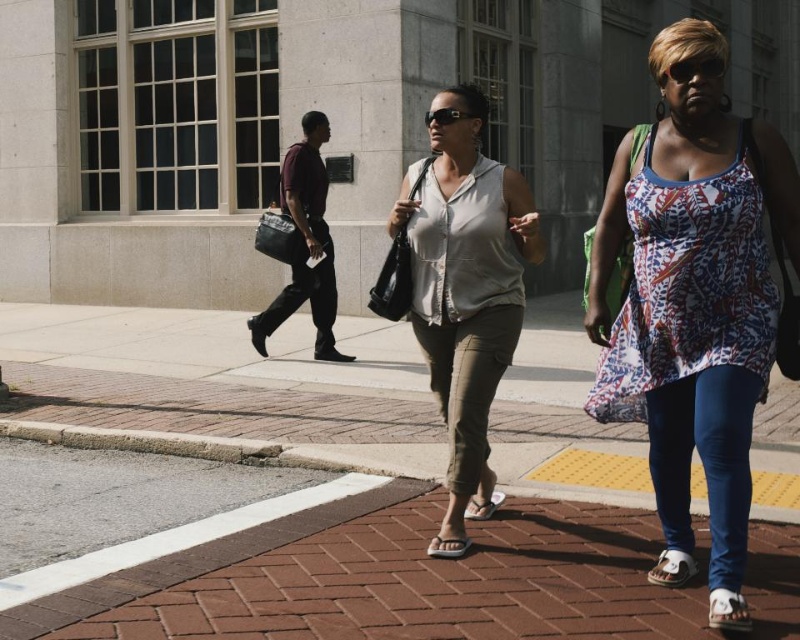
Question: Which of the following is the farthest from the observer?

Choices:
 (A) (288, 257)
 (B) (524, 228)

Answer: (A)

Question: Can you confirm if printed fabric tank top at center is positioned above dark maroon fabric bag at center?

Choices:
 (A) no
 (B) yes

Answer: (A)

Question: Can you confirm if printed fabric tank top at center is smaller than matte gray shirt at center?

Choices:
 (A) yes
 (B) no

Answer: (B)

Question: Observing the image, what is the correct spatial positioning of matte gray shirt at center in reference to dark maroon fabric bag at center?

Choices:
 (A) above
 (B) below

Answer: (B)

Question: Which object appears farthest from the camera in this image?

Choices:
 (A) printed fabric tank top at center
 (B) dark maroon fabric bag at center
 (C) matte gray shirt at center

Answer: (B)

Question: Which object is closer to the camera taking this photo?

Choices:
 (A) matte gray shirt at center
 (B) dark maroon fabric bag at center
 (C) printed fabric tank top at center

Answer: (C)